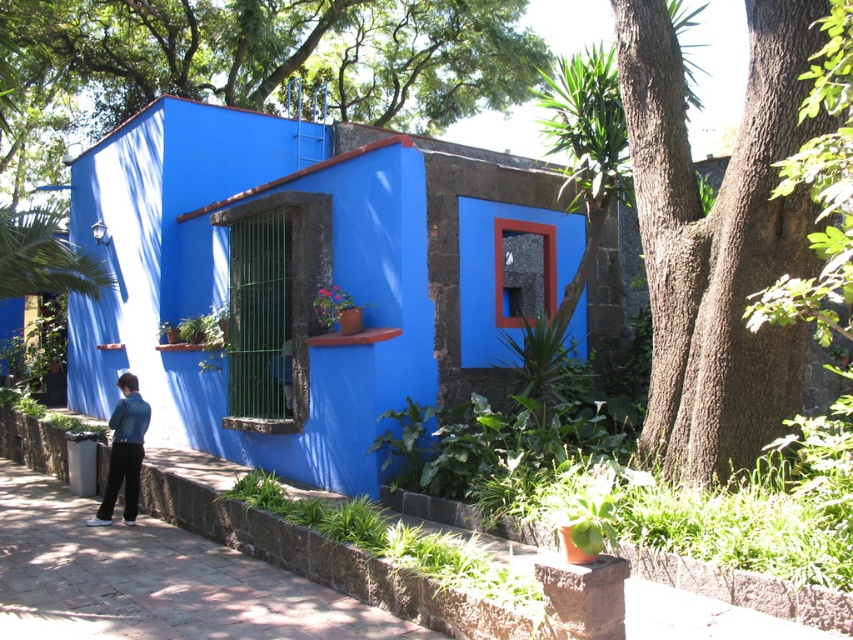
Question: In this image, where is green leafy tree at upper center located relative to brown rough bark tree at right?

Choices:
 (A) below
 (B) above

Answer: (B)

Question: Does green leafy tree at upper center have a larger size compared to brown rough bark tree at right?

Choices:
 (A) no
 (B) yes

Answer: (B)

Question: Which of these objects is positioned farthest from the green leafy tree at upper center?

Choices:
 (A) denim jacket at lower left
 (B) brown rough bark tree at right

Answer: (A)

Question: Is green leafy tree at upper center above denim jacket at lower left?

Choices:
 (A) yes
 (B) no

Answer: (A)

Question: Which of these objects is positioned farthest from the brown rough bark tree at right?

Choices:
 (A) green leafy tree at upper center
 (B) denim jacket at lower left

Answer: (A)

Question: Which is farther from the green leafy tree at upper center?

Choices:
 (A) brown rough bark tree at right
 (B) denim jacket at lower left

Answer: (B)